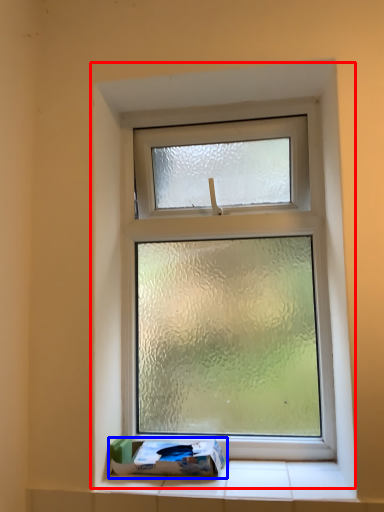
Question: Which of the following is the farthest to the observer, window (highlighted by a red box) or box (highlighted by a blue box)?

Choices:
 (A) window
 (B) box

Answer: (A)